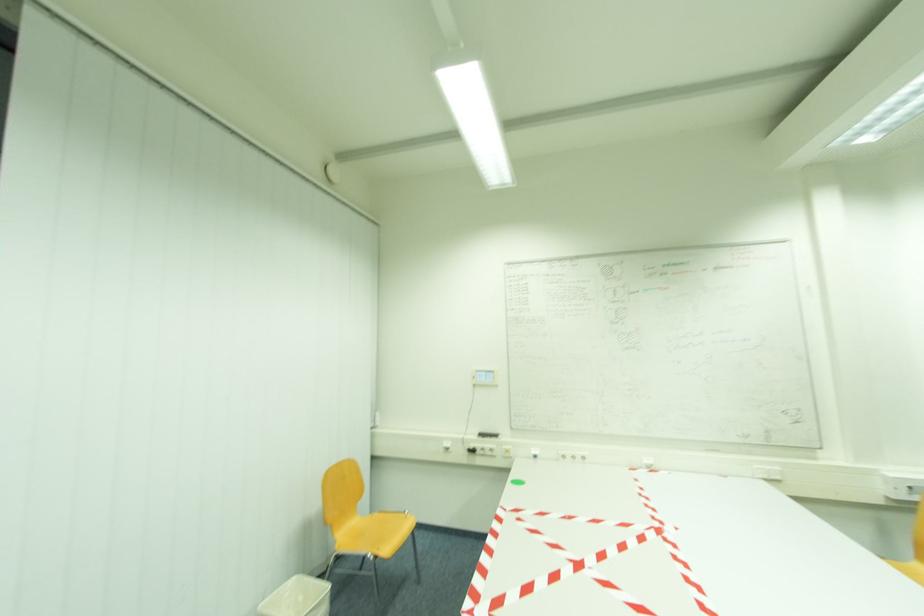
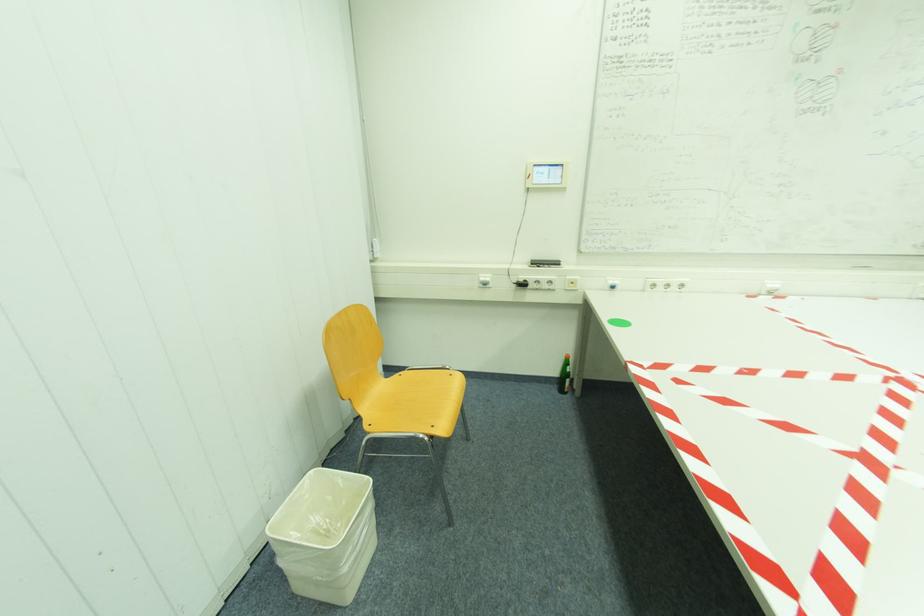
Based on the photo, the images are taken continuously from a first-person perspective. In which direction are you moving?

The movement direction of the cameraman is left, forward.